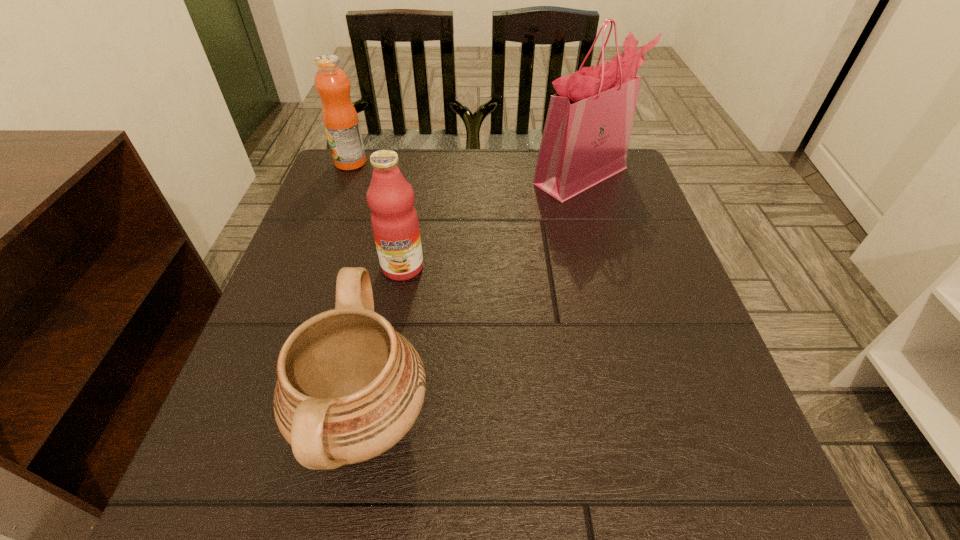
I want to click on unoccupied position between the nearer fruit juice and the tallest object, so click(x=492, y=221).

Find the location of a particular element. The width and height of the screenshot is (960, 540). empty space between the shortest object and the shopping bag is located at coordinates (473, 298).

Image resolution: width=960 pixels, height=540 pixels. Identify the location of unoccupied position between the tallest object and the left fruit juice. (467, 169).

Locate an element on the screen. free area in between the rightmost object and the nearer fruit juice is located at coordinates (492, 221).

Locate which object ranks third in proximity to the second nearest object. Please provide its 2D coordinates. Your answer should be formatted as a tuple, i.e. [(x, y)], where the tuple contains the x and y coordinates of a point satisfying the conditions above.

[(332, 84)]

Point out which object is positioned as the nearest to the nearest object. Please provide its 2D coordinates. Your answer should be formatted as a tuple, i.e. [(x, y)], where the tuple contains the x and y coordinates of a point satisfying the conditions above.

[(394, 220)]

This screenshot has height=540, width=960. What are the coordinates of `blank area in the image that satisfies the following two spatial constraints: 1. on the label of the second nearest object; 2. on the front-facing side of the urn` in the screenshot? It's located at (376, 421).

Where is `vacant space that satisfies the following two spatial constraints: 1. on the label of the second nearest object; 2. on the front-facing side of the shortest object`? vacant space that satisfies the following two spatial constraints: 1. on the label of the second nearest object; 2. on the front-facing side of the shortest object is located at coordinates (376, 421).

Find the location of a particular element. vacant area in the image that satisfies the following two spatial constraints: 1. on the label of the right fruit juice; 2. on the front-facing side of the shortest object is located at coordinates (376, 421).